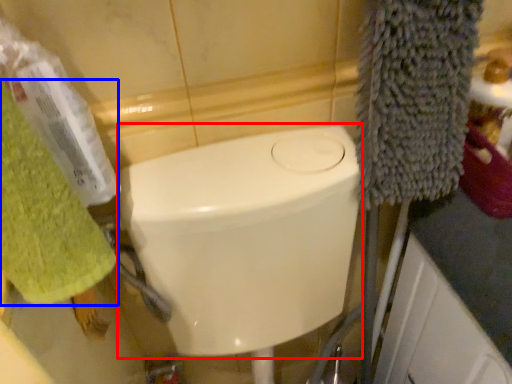
Question: Which object appears closest to the camera in this image, bidet (highlighted by a red box) or towel/napkin (highlighted by a blue box)?

Choices:
 (A) bidet
 (B) towel/napkin

Answer: (B)